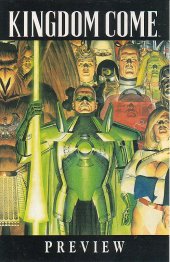
I want to click on cover, so click(92, 162).